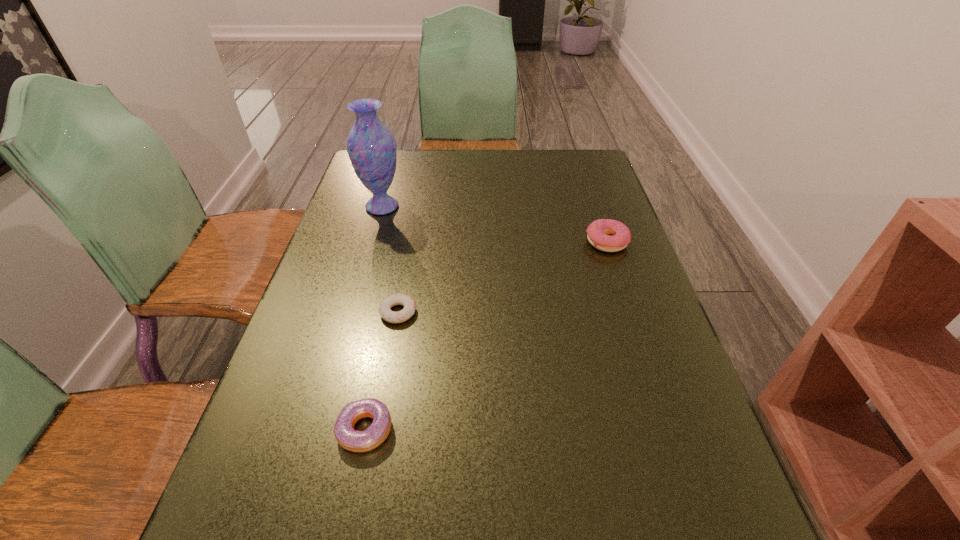
Choose which doughnut is the second nearest neighbor to the nearest doughnut. Please provide its 2D coordinates. Your answer should be formatted as a tuple, i.e. [(x, y)], where the tuple contains the x and y coordinates of a point satisfying the conditions above.

[(598, 231)]

Identify the location of free space that satisfies the following two spatial constraints: 1. on the back side of the rightmost object; 2. on the right side of the shortest doughnut. (411, 242).

You are a GUI agent. You are given a task and a screenshot of the screen. Output one action in this format:
    pyautogui.click(x=<x>, y=<y>)
    Task: Click on the vacant point that satisfies the following two spatial constraints: 1. on the back side of the nearest object; 2. on the left side of the shortest object
    
    Given the screenshot: What is the action you would take?
    pyautogui.click(x=389, y=312)

Where is `free space that satisfies the following two spatial constraints: 1. on the front side of the vase; 2. on the left side of the shortest object`? This screenshot has width=960, height=540. free space that satisfies the following two spatial constraints: 1. on the front side of the vase; 2. on the left side of the shortest object is located at coordinates (351, 312).

The height and width of the screenshot is (540, 960). What are the coordinates of `free space that satisfies the following two spatial constraints: 1. on the back side of the farthest doughnut; 2. on the right side of the nearest doughnut` in the screenshot? It's located at (403, 242).